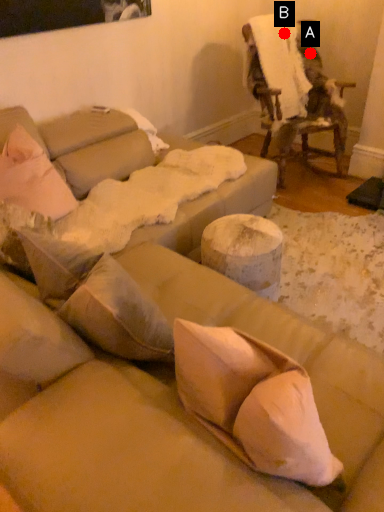
Question: Two points are circled on the image, labeled by A and B beside each circle. Which point appears closest to the camera in this image?

Choices:
 (A) A is closer
 (B) B is closer

Answer: (B)